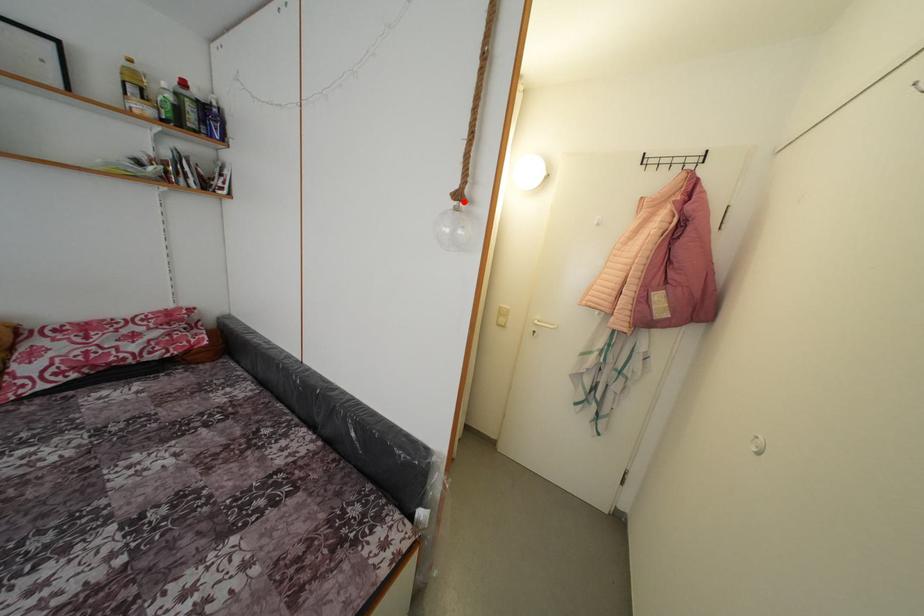
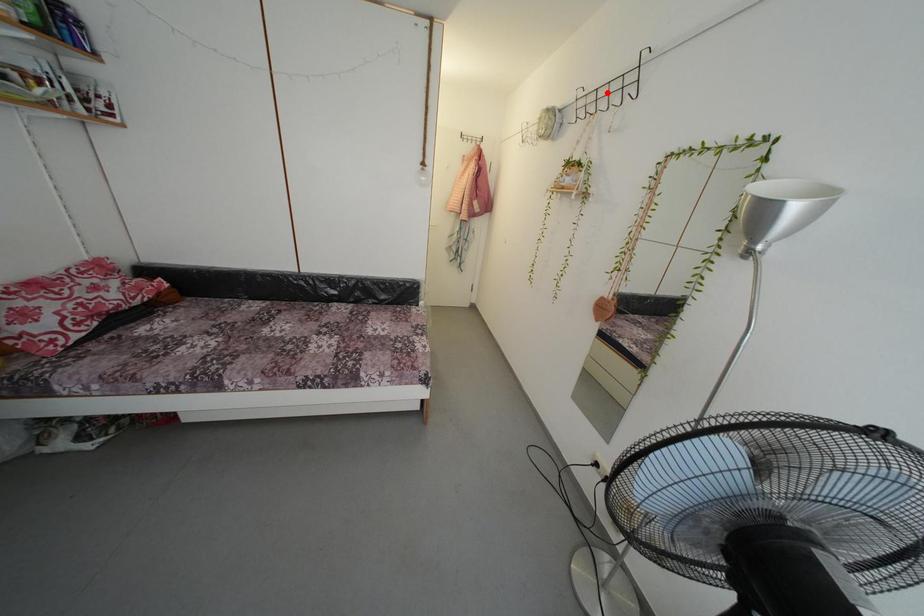
I am providing you with two images of the same scene from different viewpoints. A red point is marked on the first image and another point is marked on the second image. Do the highlighted points in image1 and image2 indicate the same real-world spot?

No